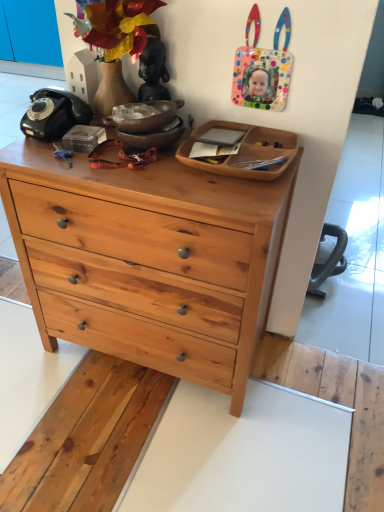
Locate an element on the screen. vacant region above natural wood chest of drawers at center (from a real-world perspective) is located at coordinates (121, 155).